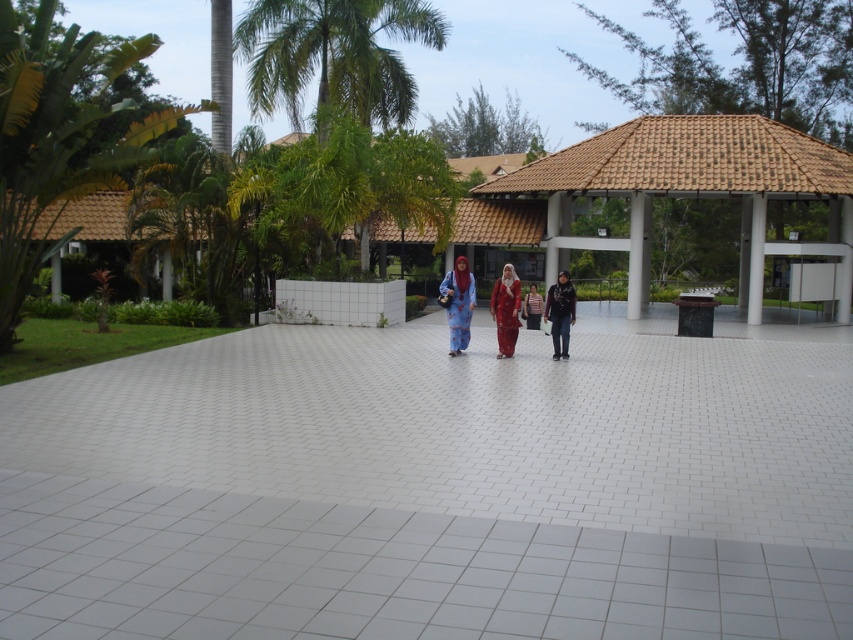
Question: Is matte red dress at center to the right of striped shirt at center from the viewer's perspective?

Choices:
 (A) yes
 (B) no

Answer: (B)

Question: Which point is farther to the camera?

Choices:
 (A) (842, 554)
 (B) (299, 38)

Answer: (B)

Question: Which object is farther from the camera taking this photo?

Choices:
 (A) green leafy palm tree at left
 (B) matte blue dress at center
 (C) matte black jacket at center

Answer: (B)

Question: Does green leafy palm tree at left appear under matte black jacket at center?

Choices:
 (A) yes
 (B) no

Answer: (B)

Question: Does green leafy palm tree at left appear on the right side of matte red dress at center?

Choices:
 (A) no
 (B) yes

Answer: (A)

Question: Which of the following is the farthest from the observer?

Choices:
 (A) (384, 102)
 (B) (567, 300)
 (C) (682, 144)
 (D) (96, 154)

Answer: (A)